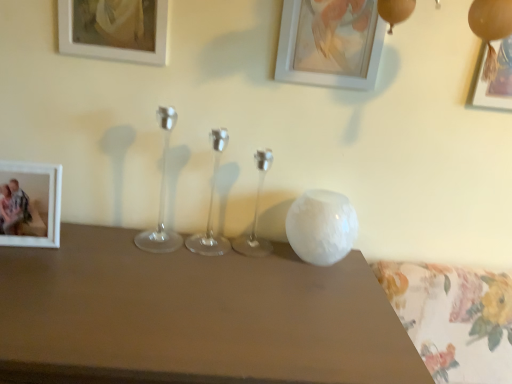
Question: Is matte white picture frame at upper left, which ranks as the 3th picture frame in right-to-left order, far away from white matte picture frame at upper center, which is counted as the 2th picture frame, starting from the right?

Choices:
 (A) no
 (B) yes

Answer: (A)

Question: Is white matte picture frame at upper center, which is counted as the 2th picture frame, starting from the right, located within matte white picture frame at upper left, which ranks as the 3th picture frame in right-to-left order?

Choices:
 (A) no
 (B) yes

Answer: (A)

Question: From the image's perspective, would you say matte white picture frame at upper left, the second picture frame positioned from the left, is positioned over white matte picture frame at upper center, which is counted as the 3th picture frame, starting from the left?

Choices:
 (A) no
 (B) yes

Answer: (B)

Question: Does matte white picture frame at upper left, the second picture frame positioned from the left, have a larger size compared to white matte picture frame at upper center, which is counted as the 3th picture frame, starting from the left?

Choices:
 (A) no
 (B) yes

Answer: (A)

Question: Does matte white picture frame at upper left, which ranks as the 3th picture frame in right-to-left order, have a lesser width compared to white matte picture frame at upper center, which is counted as the 3th picture frame, starting from the left?

Choices:
 (A) yes
 (B) no

Answer: (A)

Question: Would you say white matte picture frame at upper center, which is counted as the 3th picture frame, starting from the left, is inside or outside white glossy vase at upper right?

Choices:
 (A) outside
 (B) inside

Answer: (A)

Question: Looking at the image, does white matte picture frame at upper center, which is counted as the 3th picture frame, starting from the left, seem bigger or smaller compared to white glossy vase at upper right?

Choices:
 (A) big
 (B) small

Answer: (B)

Question: In terms of width, does white matte picture frame at upper center, which is counted as the 3th picture frame, starting from the left, look wider or thinner when compared to white glossy vase at upper right?

Choices:
 (A) wide
 (B) thin

Answer: (B)

Question: In the image, is white matte picture frame at upper center, which is counted as the 3th picture frame, starting from the left, on the left side or the right side of white glossy vase at upper right?

Choices:
 (A) right
 (B) left

Answer: (A)

Question: In terms of height, does metallic gold picture frame at upper right, arranged as the fourth picture frame when viewed from the left, look taller or shorter compared to matte white picture frame at upper left, the second picture frame positioned from the left?

Choices:
 (A) tall
 (B) short

Answer: (B)

Question: Based on their positions, is metallic gold picture frame at upper right, arranged as the fourth picture frame when viewed from the left, located to the left or right of matte white picture frame at upper left, the second picture frame positioned from the left?

Choices:
 (A) right
 (B) left

Answer: (A)

Question: Considering their positions, is metallic gold picture frame at upper right, arranged as the fourth picture frame when viewed from the left, located in front of or behind matte white picture frame at upper left, which ranks as the 3th picture frame in right-to-left order?

Choices:
 (A) front
 (B) behind

Answer: (B)

Question: Is point (470, 89) positioned closer to the camera than point (111, 1)?

Choices:
 (A) farther
 (B) closer

Answer: (A)

Question: Is point (508, 104) closer or farther from the camera than point (25, 175)?

Choices:
 (A) farther
 (B) closer

Answer: (A)

Question: In the image, is metallic gold picture frame at upper right, the 1th picture frame viewed from the right, on the left side or the right side of white matte picture frame at left, which is the 1th picture frame from left to right?

Choices:
 (A) right
 (B) left

Answer: (A)